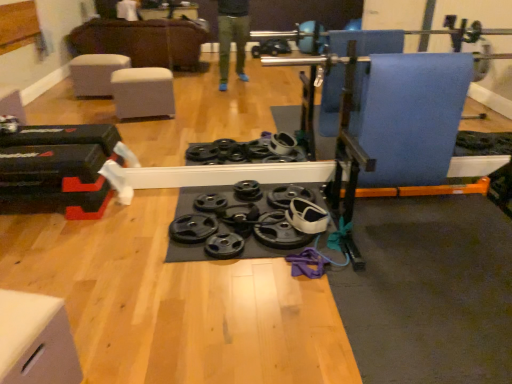
You are a GUI agent. You are given a task and a screenshot of the screen. Output one action in this format:
    pyautogui.click(x=<x>, y=<y>)
    Task: Click on the white matte drawer at lower left
    
    Given the screenshot: What is the action you would take?
    pyautogui.click(x=36, y=340)

The height and width of the screenshot is (384, 512). What do you see at coordinates (224, 245) in the screenshot?
I see `black rubber weight plate at center, placed as the 2th wheel when sorted from left to right` at bounding box center [224, 245].

Identify the location of black rubber weight plate at center, the first wheel viewed from the left. This screenshot has width=512, height=384. (192, 228).

Looking at this image, measure the distance between black rubber weight plate at center, positioned as the third wheel in left-to-right order, and black rubber weight plate at center, placed as the 2th wheel when sorted from left to right.

black rubber weight plate at center, positioned as the third wheel in left-to-right order, and black rubber weight plate at center, placed as the 2th wheel when sorted from left to right, are 9.22 inches apart from each other.

Is black rubber weight plate at center, the 1th wheel from the right, far away from black rubber weight plate at center, placed as the second wheel when sorted from right to left?

No, black rubber weight plate at center, the 1th wheel from the right, is in close proximity to black rubber weight plate at center, placed as the second wheel when sorted from right to left.

Considering the positions of objects black rubber weight plate at center, positioned as the third wheel in left-to-right order, and black rubber weight plate at center, placed as the 2th wheel when sorted from left to right, in the image provided, who is more to the left, black rubber weight plate at center, positioned as the third wheel in left-to-right order, or black rubber weight plate at center, placed as the 2th wheel when sorted from left to right,?

From the viewer's perspective, black rubber weight plate at center, placed as the 2th wheel when sorted from left to right, appears more on the left side.

Which object is wider, black rubber weight plate at center, positioned as the third wheel in left-to-right order, or black rubber weight plate at center, placed as the second wheel when sorted from right to left?

Wider between the two is black rubber weight plate at center, positioned as the third wheel in left-to-right order.

From the image's perspective, does black rubber weight plate at center, placed as the second wheel when sorted from right to left, appear lower than black rubber weight plate at center, the third wheel from the right?

Indeed, from the image's perspective, black rubber weight plate at center, placed as the second wheel when sorted from right to left, is shown beneath black rubber weight plate at center, the third wheel from the right.

Is black rubber weight plate at center, placed as the 2th wheel when sorted from left to right, to the left of black rubber weight plate at center, the first wheel viewed from the left, from the viewer's perspective?

No.

Is the surface of black rubber weight plate at center, placed as the second wheel when sorted from right to left, in direct contact with black rubber weight plate at center, the first wheel viewed from the left?

No, black rubber weight plate at center, placed as the second wheel when sorted from right to left, is not touching black rubber weight plate at center, the first wheel viewed from the left.

From the picture: Could you measure the distance between black rubber weight plate at center, placed as the 2th wheel when sorted from left to right, and white matte drawer at lower left?

They are 1.12 meters apart.

I want to click on furniture below the black rubber weight plate at center, placed as the second wheel when sorted from right to left (from the image's perspective), so (36, 340).

From a real-world perspective, is black rubber weight plate at center, placed as the second wheel when sorted from right to left, physically below white matte drawer at lower left?

Yes.

Considering the sizes of objects black rubber weight plate at center, placed as the 2th wheel when sorted from left to right, and white matte drawer at lower left in the image provided, who is smaller, black rubber weight plate at center, placed as the 2th wheel when sorted from left to right, or white matte drawer at lower left?

black rubber weight plate at center, placed as the 2th wheel when sorted from left to right, is smaller.

Which point is more forward, (55, 376) or (217, 233)?

Point (55, 376)

Looking at this image, between white matte drawer at lower left and black rubber weight plate at center, placed as the second wheel when sorted from right to left, which one appears on the right side from the viewer's perspective?

black rubber weight plate at center, placed as the second wheel when sorted from right to left, is more to the right.

From the image's perspective, between white matte drawer at lower left and black rubber weight plate at center, placed as the 2th wheel when sorted from left to right, who is located below?

white matte drawer at lower left, from the image's perspective.

From a real-world perspective, is white matte drawer at lower left above or below black rubber weight plate at center, placed as the second wheel when sorted from right to left?

From a real-world perspective, white matte drawer at lower left is physically above black rubber weight plate at center, placed as the second wheel when sorted from right to left.

From the image's perspective, between black rubber weight plate at center, the first wheel viewed from the left, and black rubber weight plate at center, placed as the second wheel when sorted from right to left, which one is located above?

black rubber weight plate at center, the first wheel viewed from the left, is shown above in the image.

From the picture: Is black rubber weight plate at center, the first wheel viewed from the left, inside or outside of black rubber weight plate at center, placed as the second wheel when sorted from right to left?

black rubber weight plate at center, the first wheel viewed from the left, is outside black rubber weight plate at center, placed as the second wheel when sorted from right to left.

Measure the distance between black rubber weight plate at center, the first wheel viewed from the left, and black rubber weight plate at center, placed as the 2th wheel when sorted from left to right.

black rubber weight plate at center, the first wheel viewed from the left, is 6.49 inches from black rubber weight plate at center, placed as the 2th wheel when sorted from left to right.

Could you tell me if black rubber weight plate at center, the first wheel viewed from the left, is facing black rubber weight plate at center, placed as the second wheel when sorted from right to left?

No, black rubber weight plate at center, the first wheel viewed from the left, is not turned towards black rubber weight plate at center, placed as the second wheel when sorted from right to left.

Considering the relative sizes of black rubber weight plate at center, placed as the second wheel when sorted from right to left, and black rubber weight plate at center, positioned as the third wheel in left-to-right order, in the image provided, is black rubber weight plate at center, placed as the second wheel when sorted from right to left, taller than black rubber weight plate at center, positioned as the third wheel in left-to-right order,?

In fact, black rubber weight plate at center, placed as the second wheel when sorted from right to left, may be shorter than black rubber weight plate at center, positioned as the third wheel in left-to-right order.

How far apart are black rubber weight plate at center, placed as the 2th wheel when sorted from left to right, and black rubber weight plate at center, positioned as the third wheel in left-to-right order?

They are 9.22 inches apart.

Visually, is black rubber weight plate at center, placed as the 2th wheel when sorted from left to right, positioned to the left or to the right of black rubber weight plate at center, positioned as the third wheel in left-to-right order?

black rubber weight plate at center, placed as the 2th wheel when sorted from left to right, is positioned on black rubber weight plate at center, positioned as the third wheel in left-to-right order,'s left side.

Is black rubber weight plate at center, placed as the second wheel when sorted from right to left, facing away from black rubber weight plate at center, the 1th wheel from the right?

black rubber weight plate at center, placed as the second wheel when sorted from right to left, does not have its back to black rubber weight plate at center, the 1th wheel from the right.

Who is taller, white matte drawer at lower left or black rubber weight plate at center, positioned as the third wheel in left-to-right order?

white matte drawer at lower left is taller.

In the scene shown: Looking at their sizes, would you say white matte drawer at lower left is wider or thinner than black rubber weight plate at center, the 1th wheel from the right?

In the image, white matte drawer at lower left appears to be more narrow than black rubber weight plate at center, the 1th wheel from the right.

Is white matte drawer at lower left placed right next to black rubber weight plate at center, the 1th wheel from the right?

No, white matte drawer at lower left is not making contact with black rubber weight plate at center, the 1th wheel from the right.

Between white matte drawer at lower left and black rubber weight plate at center, the 1th wheel from the right, which one has larger size?

white matte drawer at lower left is bigger.

Where is `wheel located on the right of black rubber weight plate at center, placed as the 2th wheel when sorted from left to right`? This screenshot has width=512, height=384. wheel located on the right of black rubber weight plate at center, placed as the 2th wheel when sorted from left to right is located at coordinates (279, 232).

You are a GUI agent. You are given a task and a screenshot of the screen. Output one action in this format:
    pyautogui.click(x=<x>, y=<y>)
    Task: Click on the wheel that appears on the left of black rubber weight plate at center, placed as the 2th wheel when sorted from left to right
    The height and width of the screenshot is (384, 512).
    Given the screenshot: What is the action you would take?
    pyautogui.click(x=192, y=228)

In the scene shown: Estimate the real-world distances between objects in this image. Which object is closer to black rubber weight plate at center, positioned as the third wheel in left-to-right order, black rubber weight plate at center, placed as the second wheel when sorted from right to left, or white matte drawer at lower left?

The object closer to black rubber weight plate at center, positioned as the third wheel in left-to-right order, is black rubber weight plate at center, placed as the second wheel when sorted from right to left.

Which object lies further to the anchor point black rubber weight plate at center, placed as the 2th wheel when sorted from left to right, white matte drawer at lower left or black rubber weight plate at center, positioned as the third wheel in left-to-right order?

white matte drawer at lower left lies further to black rubber weight plate at center, placed as the 2th wheel when sorted from left to right, than the other object.

When comparing their distances from black rubber weight plate at center, the 1th wheel from the right, does black rubber weight plate at center, the third wheel from the right, or white matte drawer at lower left seem closer?

black rubber weight plate at center, the third wheel from the right, is closer to black rubber weight plate at center, the 1th wheel from the right.

Looking at the image, which one is located further to black rubber weight plate at center, the third wheel from the right, black rubber weight plate at center, the 1th wheel from the right, or white matte drawer at lower left?

white matte drawer at lower left lies further to black rubber weight plate at center, the third wheel from the right, than the other object.

Estimate the real-world distances between objects in this image. Which object is further from black rubber weight plate at center, the first wheel viewed from the left, white matte drawer at lower left or black rubber weight plate at center, placed as the 2th wheel when sorted from left to right?

Based on the image, white matte drawer at lower left appears to be further to black rubber weight plate at center, the first wheel viewed from the left.

Looking at the image, which one is located closer to black rubber weight plate at center, the 1th wheel from the right, white matte drawer at lower left or black rubber weight plate at center, placed as the 2th wheel when sorted from left to right?

black rubber weight plate at center, placed as the 2th wheel when sorted from left to right, is positioned closer to the anchor black rubber weight plate at center, the 1th wheel from the right.

From the image, which object appears to be nearer to black rubber weight plate at center, the third wheel from the right, black rubber weight plate at center, positioned as the third wheel in left-to-right order, or black rubber weight plate at center, placed as the second wheel when sorted from right to left?

black rubber weight plate at center, placed as the second wheel when sorted from right to left.

Estimate the real-world distances between objects in this image. Which object is closer to white matte drawer at lower left, black rubber weight plate at center, placed as the 2th wheel when sorted from left to right, or black rubber weight plate at center, the 1th wheel from the right?

black rubber weight plate at center, placed as the 2th wheel when sorted from left to right, lies closer to white matte drawer at lower left than the other object.

Locate an element on the screen. wheel between black rubber weight plate at center, the third wheel from the right, and black rubber weight plate at center, positioned as the third wheel in left-to-right order, from left to right is located at coordinates (224, 245).

Locate an element on the screen. The height and width of the screenshot is (384, 512). wheel located between white matte drawer at lower left and black rubber weight plate at center, the 1th wheel from the right, in the depth direction is located at coordinates (224, 245).